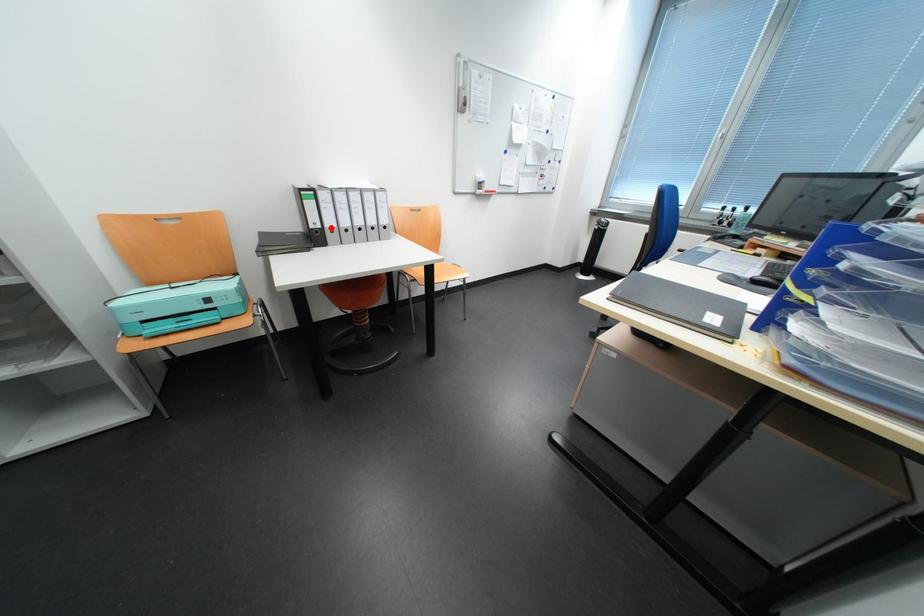
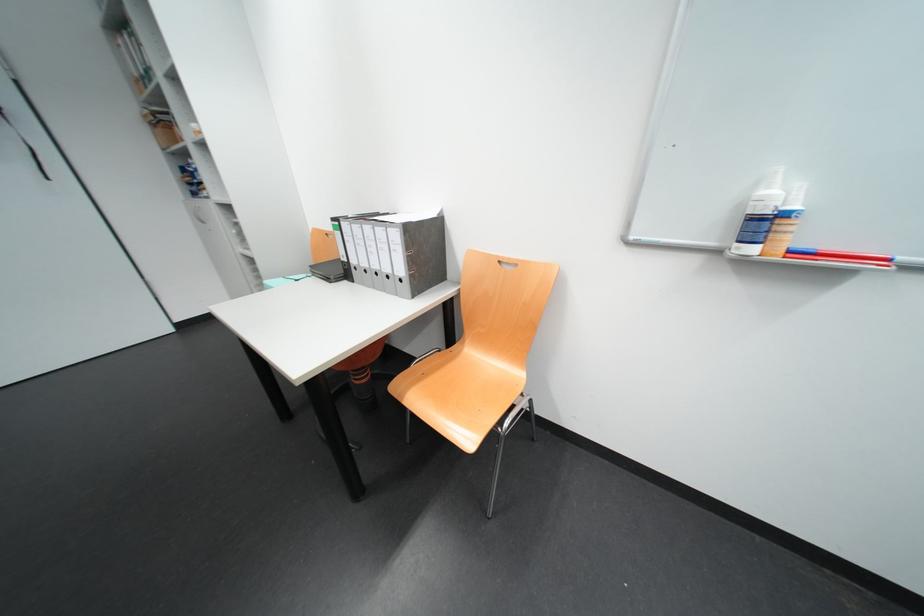
Find the pixel in the second image that matches the highlighted location in the first image.

(358, 262)